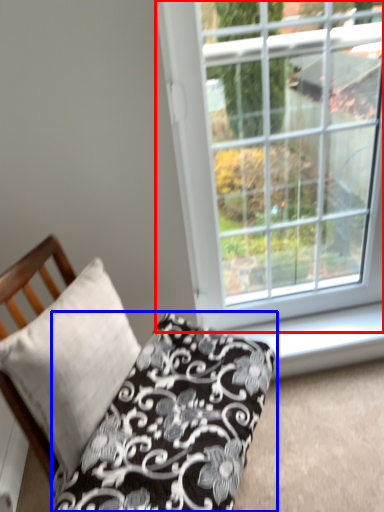
Question: Which object appears farthest to the camera in this image, window (highlighted by a red box) or pillow (highlighted by a blue box)?

Choices:
 (A) window
 (B) pillow

Answer: (A)